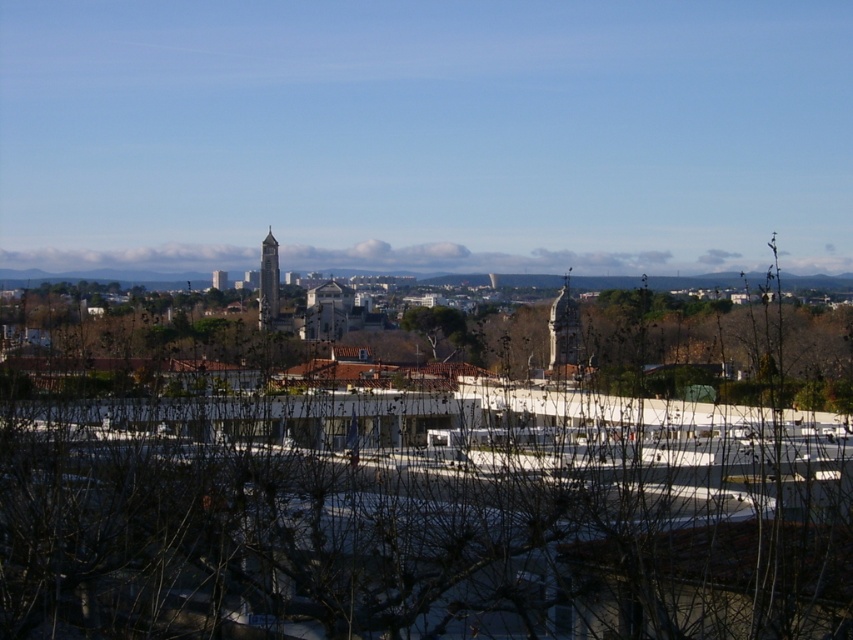
Can you confirm if brown leafless tree at center is positioned to the left of smooth stone tower at center?

Correct, you'll find brown leafless tree at center to the left of smooth stone tower at center.

Does brown leafless tree at center have a larger size compared to smooth stone tower at center?

Yes.

What do you see at coordinates (421, 513) in the screenshot? I see `brown leafless tree at center` at bounding box center [421, 513].

Image resolution: width=853 pixels, height=640 pixels. I want to click on brown leafless tree at center, so click(421, 513).

In the scene shown: Can you confirm if brown leafless tree at center is taller than smooth gray clock tower at center?

Indeed, brown leafless tree at center has a greater height compared to smooth gray clock tower at center.

Can you confirm if brown leafless tree at center is wider than smooth gray clock tower at center?

Yes.

Does point (438, 499) lie in front of point (260, 328)?

Yes, it is.

You are a GUI agent. You are given a task and a screenshot of the screen. Output one action in this format:
    pyautogui.click(x=<x>, y=<y>)
    Task: Click on the brown leafless tree at center
    This screenshot has height=640, width=853.
    Given the screenshot: What is the action you would take?
    pyautogui.click(x=421, y=513)

Who is more distant from viewer, (556, 371) or (270, 252)?

Positioned behind is point (270, 252).

Who is more forward, (550, 364) or (276, 252)?

Point (550, 364) is in front.

This screenshot has height=640, width=853. I want to click on smooth stone tower at center, so click(564, 336).